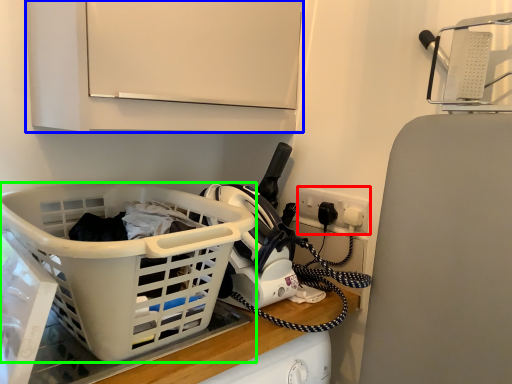
Question: Estimate the real-world distances between objects in this image. Which object is farther from electric outlet (highlighted by a red box), cabinetry (highlighted by a blue box) or basket (highlighted by a green box)?

Choices:
 (A) cabinetry
 (B) basket

Answer: (B)